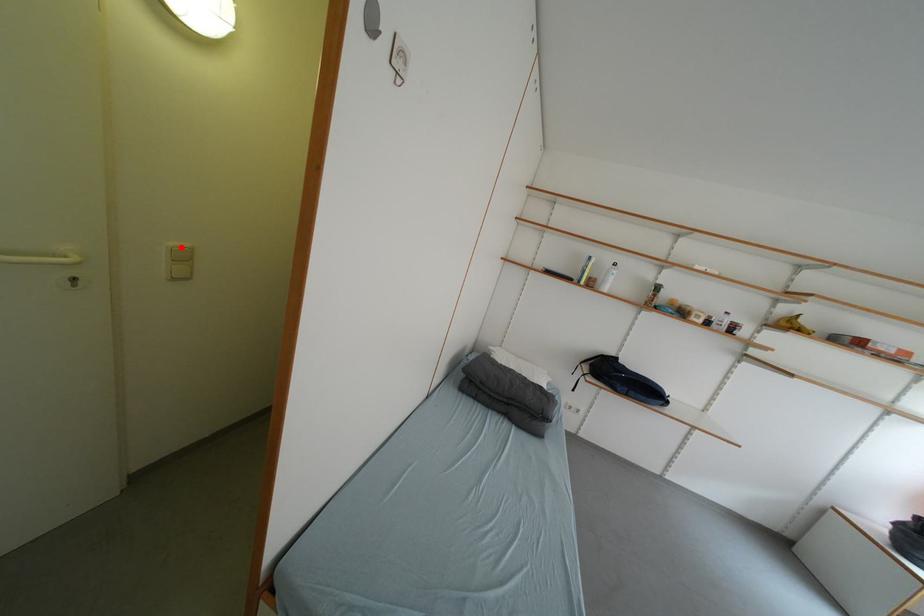
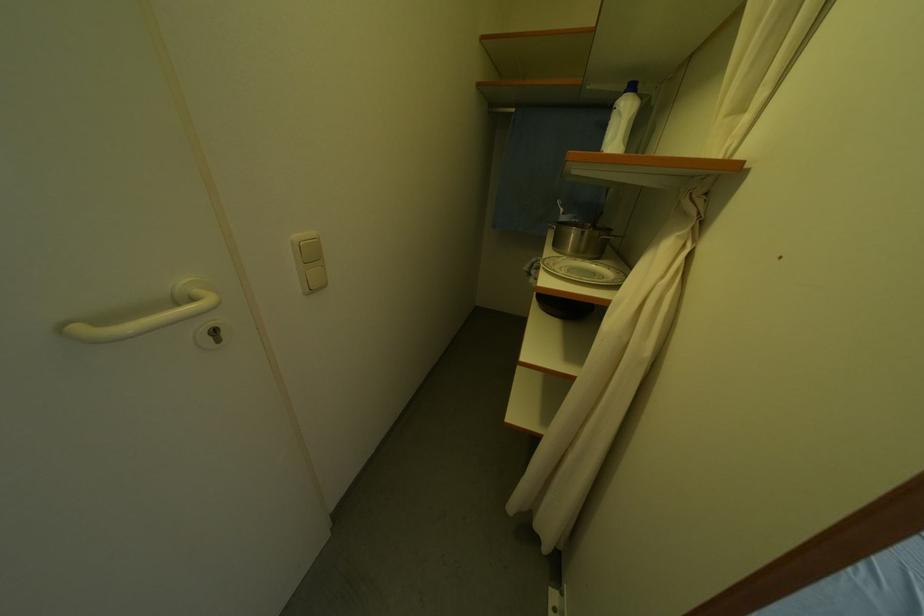
In the second image, find the point that corresponds to the highlighted location in the first image.

(306, 238)